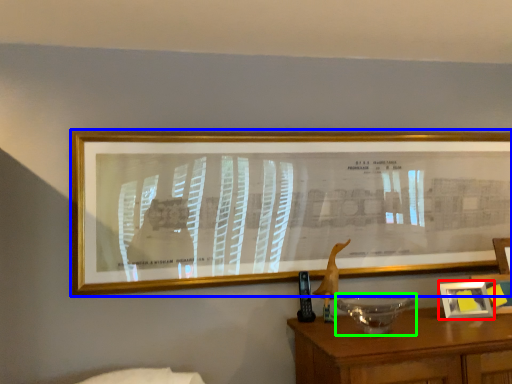
Question: Based on their relative distances, which object is nearer to picture frame (highlighted by a red box)? Choose from picture frame (highlighted by a blue box) and glass bowl (highlighted by a green box).

Choices:
 (A) picture frame
 (B) glass bowl

Answer: (B)